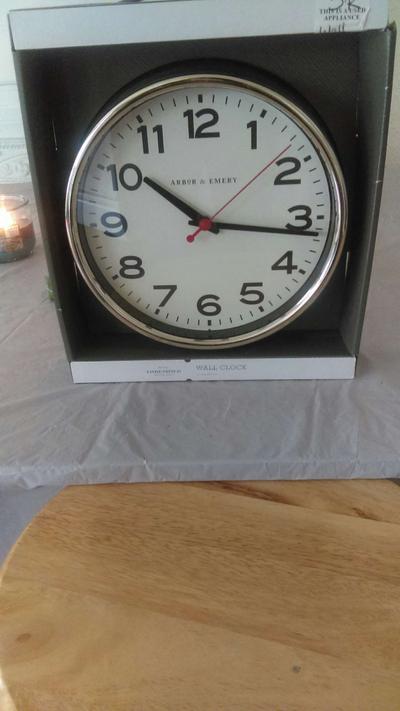
Locate an element on the screen. wall is located at coordinates (6, 67).